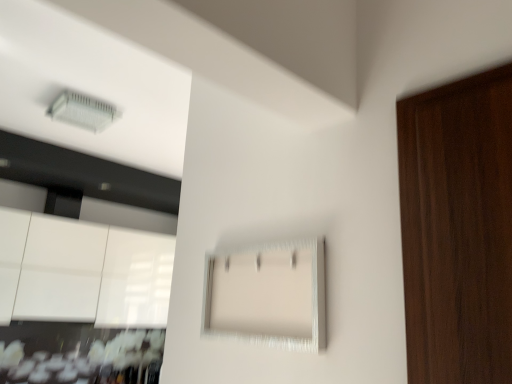
Question: Considering the relative sizes of white textured cabinet at center, arranged as the second cabinetry when viewed from the left, and clear plastic air conditioning unit at upper left in the image provided, is white textured cabinet at center, arranged as the second cabinetry when viewed from the left, wider than clear plastic air conditioning unit at upper left?

Choices:
 (A) no
 (B) yes

Answer: (A)

Question: Is the depth of white textured cabinet at center, arranged as the second cabinetry when viewed from the left, greater than that of clear plastic air conditioning unit at upper left?

Choices:
 (A) no
 (B) yes

Answer: (A)

Question: Is the depth of white textured cabinet at center, which is the first cabinetry in right-to-left order, less than that of clear plastic air conditioning unit at upper left?

Choices:
 (A) yes
 (B) no

Answer: (A)

Question: Is white textured cabinet at center, arranged as the second cabinetry when viewed from the left, in contact with clear plastic air conditioning unit at upper left?

Choices:
 (A) yes
 (B) no

Answer: (B)

Question: Considering the relative sizes of white textured cabinet at center, arranged as the second cabinetry when viewed from the left, and clear plastic air conditioning unit at upper left in the image provided, is white textured cabinet at center, arranged as the second cabinetry when viewed from the left, bigger than clear plastic air conditioning unit at upper left?

Choices:
 (A) no
 (B) yes

Answer: (A)

Question: Which is correct: glossy white cabinetry at lower left, the 1th cabinetry when ordered from back to front, is inside white textured cabinet at center, positioned as the 2th cabinetry in back-to-front order, or outside of it?

Choices:
 (A) inside
 (B) outside

Answer: (B)

Question: Looking at the image, does glossy white cabinetry at lower left, marked as the 2th cabinetry in a front-to-back arrangement, seem bigger or smaller compared to white textured cabinet at center, placed as the first cabinetry when sorted from front to back?

Choices:
 (A) big
 (B) small

Answer: (A)

Question: Is point (7, 228) positioned closer to the camera than point (283, 288)?

Choices:
 (A) farther
 (B) closer

Answer: (A)

Question: In the image, is glossy white cabinetry at lower left, the 1th cabinetry in the left-to-right sequence, on the left side or the right side of white textured cabinet at center, placed as the first cabinetry when sorted from front to back?

Choices:
 (A) left
 (B) right

Answer: (A)

Question: Is glossy white cabinetry at lower left, marked as the 2th cabinetry in a front-to-back arrangement, to the left or to the right of clear plastic air conditioning unit at upper left in the image?

Choices:
 (A) right
 (B) left

Answer: (B)

Question: Looking at the image, does glossy white cabinetry at lower left, the 1th cabinetry when ordered from back to front, seem bigger or smaller compared to clear plastic air conditioning unit at upper left?

Choices:
 (A) big
 (B) small

Answer: (A)

Question: Relative to clear plastic air conditioning unit at upper left, is glossy white cabinetry at lower left, the 1th cabinetry in the left-to-right sequence, in front or behind?

Choices:
 (A) behind
 (B) front

Answer: (A)

Question: In terms of height, does glossy white cabinetry at lower left, which is the second cabinetry in right-to-left order, look taller or shorter compared to clear plastic air conditioning unit at upper left?

Choices:
 (A) short
 (B) tall

Answer: (B)

Question: Considering their positions, is white textured cabinet at center, positioned as the 2th cabinetry in back-to-front order, located in front of or behind clear plastic air conditioning unit at upper left?

Choices:
 (A) behind
 (B) front

Answer: (B)

Question: Considering the positions of point (244, 324) and point (75, 107), is point (244, 324) closer or farther from the camera than point (75, 107)?

Choices:
 (A) closer
 (B) farther

Answer: (A)